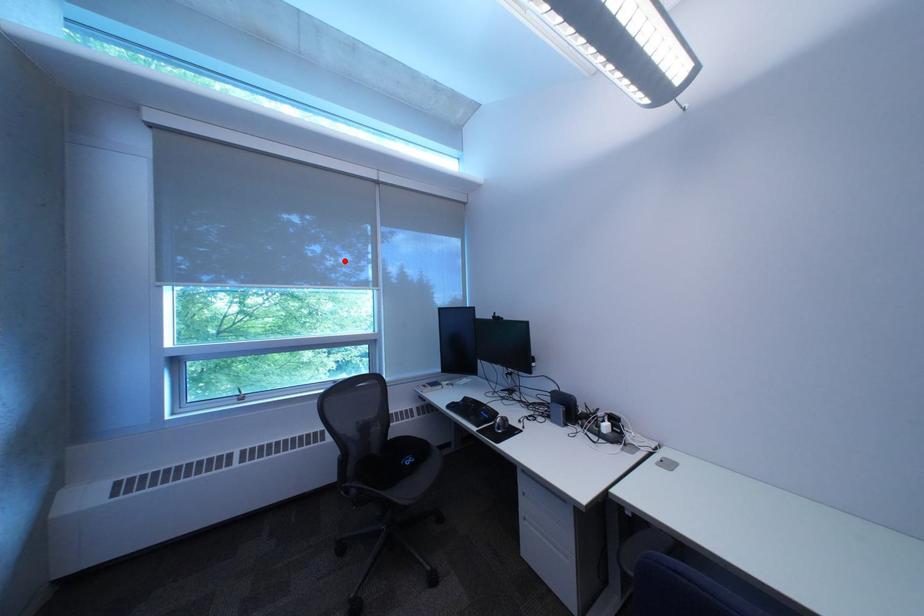
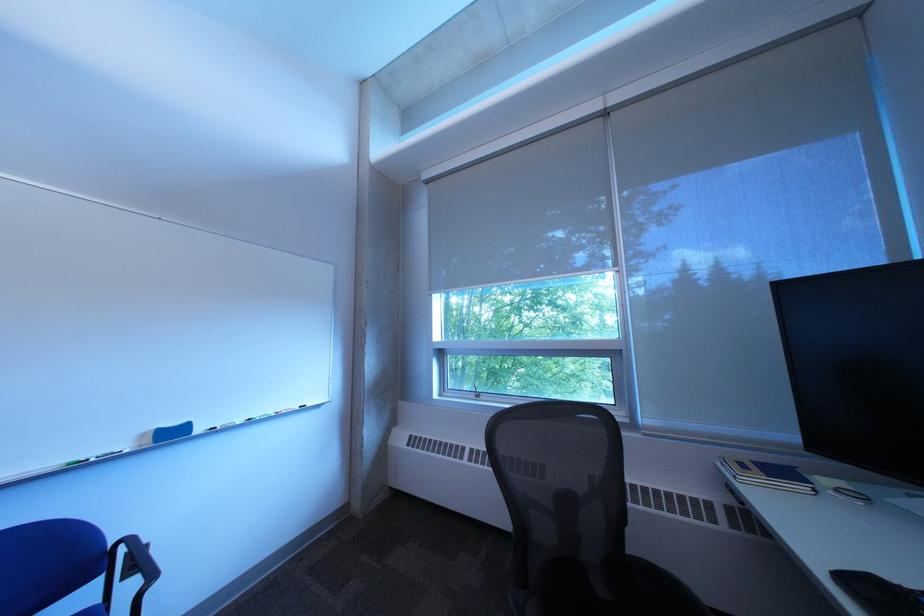
Find the pixel in the second image that matches the highlighted location in the first image.

(611, 267)